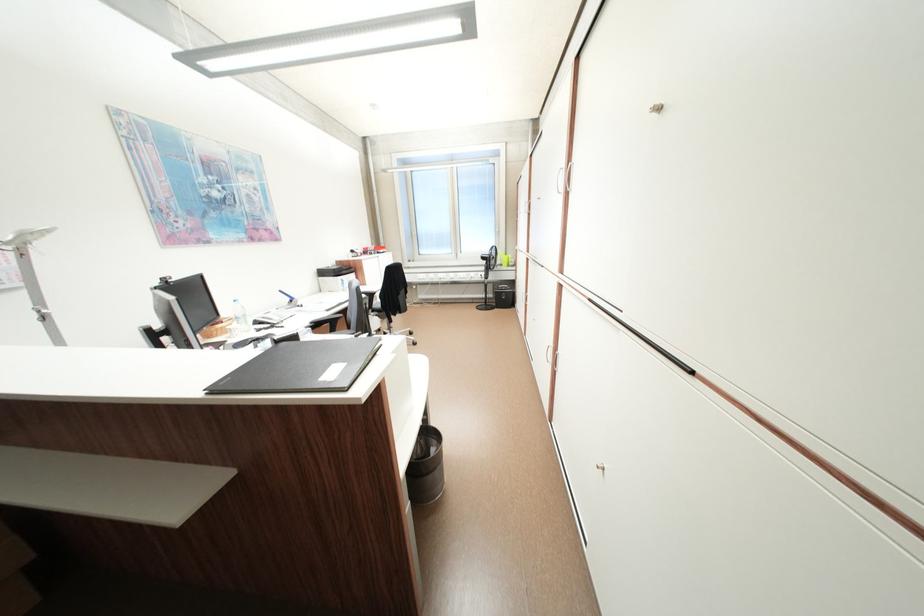
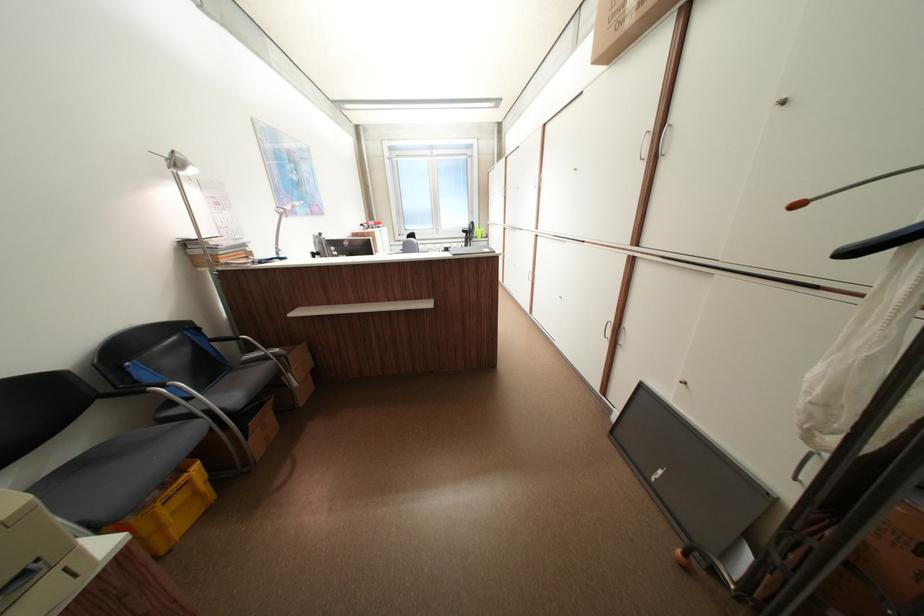
Question: I am providing you with two images of the same scene from different viewpoints. Please identify which objects are invisible in image2.

Choices:
 (A) bottle top button
 (B) black clothes hanger
 (C) silver chair armrest
 (D) telephone handset

Answer: (D)